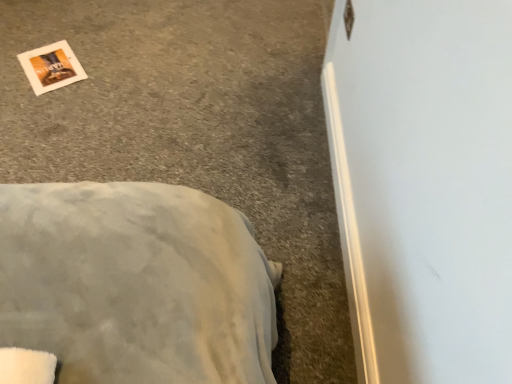
Find the location of a particular element. Image resolution: width=512 pixels, height=384 pixels. free space to the left of white paper at upper left is located at coordinates (9, 55).